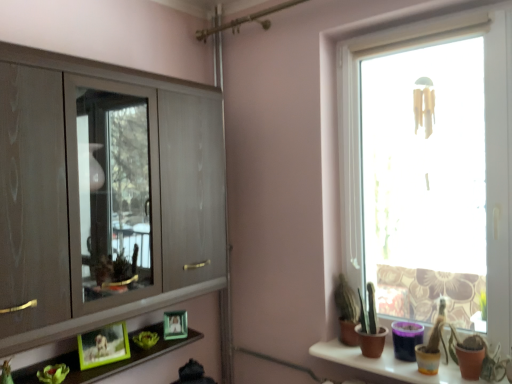
Question: Visually, is transparent glass window at right positioned to the left or to the right of terracotta clay pots at lower right?

Choices:
 (A) left
 (B) right

Answer: (B)

Question: Does point (340, 228) appear closer or farther from the camera than point (352, 367)?

Choices:
 (A) farther
 (B) closer

Answer: (A)

Question: Which of these objects is positioned farthest from the green matte plant at lower left?

Choices:
 (A) green matte picture frame at lower center, the 1th picture frame positioned from the right
 (B) terracotta clay pots at lower right
 (C) matte wood cupboard at left
 (D) transparent glass window at right
 (E) green matte picture frame at lower left, which is counted as the 1th picture frame, starting from the left

Answer: (D)

Question: Which of these objects is positioned farthest from the terracotta clay pots at lower right?

Choices:
 (A) green matte picture frame at lower left, the 2th picture frame positioned from the right
 (B) green matte plant at lower left
 (C) transparent glass window at right
 (D) green matte picture frame at lower center, which is the first picture frame in back-to-front order
 (E) matte wood cupboard at left

Answer: (B)